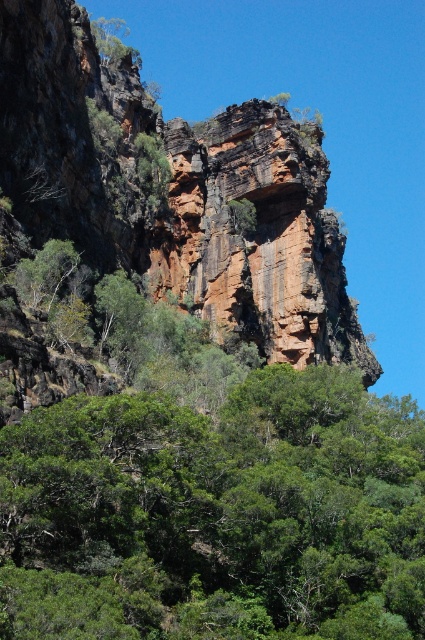
Looking at this image, you are standing at the base of the cliff and looking up. There is a point marked at coordinates (217, 513). Based on the scene description, what object is located at that point?

The point at (217, 513) corresponds to the green leafy tree at center.

From the picture: You are a hiker standing at the base of the cliff and want to climb the tallest tree to get a better view. Which tree should you choose between the green leafy tree at center and the green leafy tree at upper left?

The green leafy tree at upper left is taller than the green leafy tree at center, so you should choose the green leafy tree at upper left to climb for a better view.